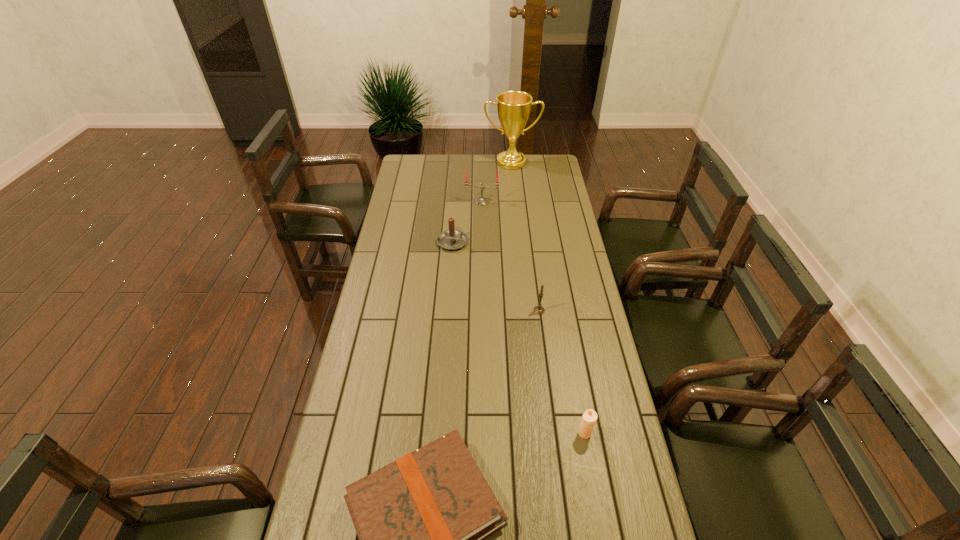
This screenshot has width=960, height=540. What are the coordinates of `free space located 0.090m on the right of the second nearest candle` in the screenshot? It's located at (569, 310).

Find the location of a particular element. free space located on the side of the third nearest candle with the handle loop is located at coordinates (456, 192).

Where is `blank area located on the side of the third nearest candle with the handle loop`? blank area located on the side of the third nearest candle with the handle loop is located at coordinates (455, 200).

You are a GUI agent. You are given a task and a screenshot of the screen. Output one action in this format:
    pyautogui.click(x=<x>, y=<y>)
    Task: Click on the free space located 0.050m on the side of the third nearest candle with the handle loop
    
    Given the screenshot: What is the action you would take?
    pyautogui.click(x=454, y=224)

Image resolution: width=960 pixels, height=540 pixels. In order to click on vacant area located 0.190m on the front of the nearest candle in this screenshot , I will do `click(599, 510)`.

This screenshot has width=960, height=540. What are the coordinates of `object at the far edge` in the screenshot? It's located at (513, 107).

Locate an element on the screen. The image size is (960, 540). award present at the right edge is located at coordinates (513, 107).

I want to click on candle present at the right edge, so click(x=589, y=418).

This screenshot has width=960, height=540. I want to click on object present at the far right corner, so click(513, 107).

In the image, there is a desktop. Find the location of `free region at the far edge`. free region at the far edge is located at coordinates (471, 163).